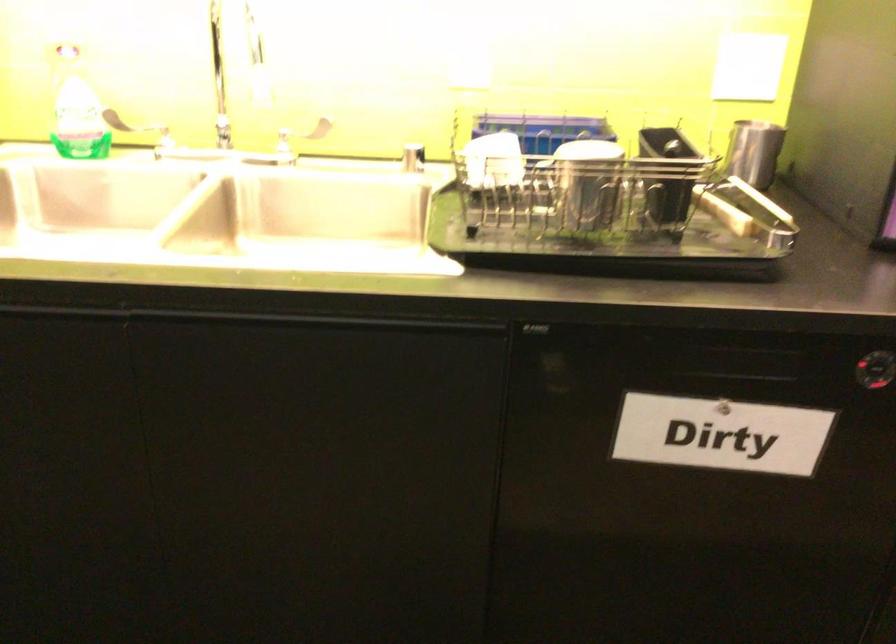
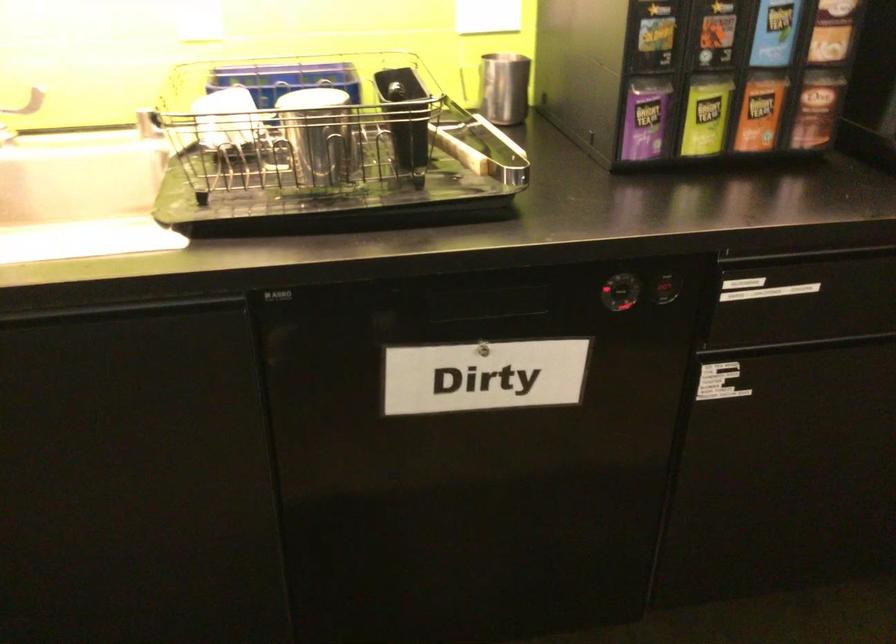
In the second image, find the point that corresponds to the point at 754,152 in the first image.

(504, 88)